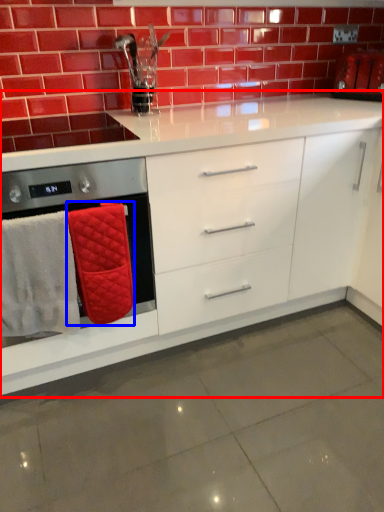
Question: Which object appears closest to the camera in this image, cabinetry (highlighted by a red box) or bath towel (highlighted by a blue box)?

Choices:
 (A) cabinetry
 (B) bath towel

Answer: (A)